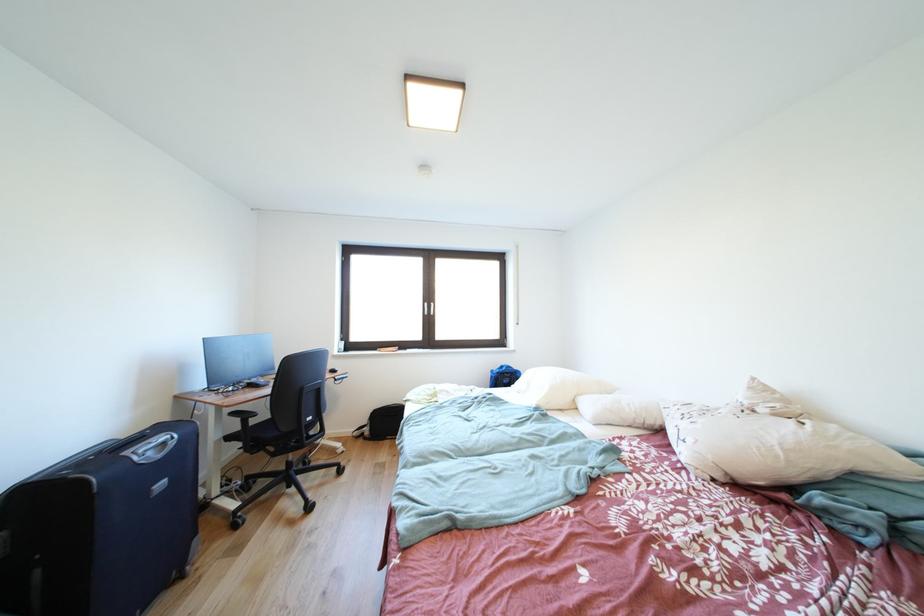
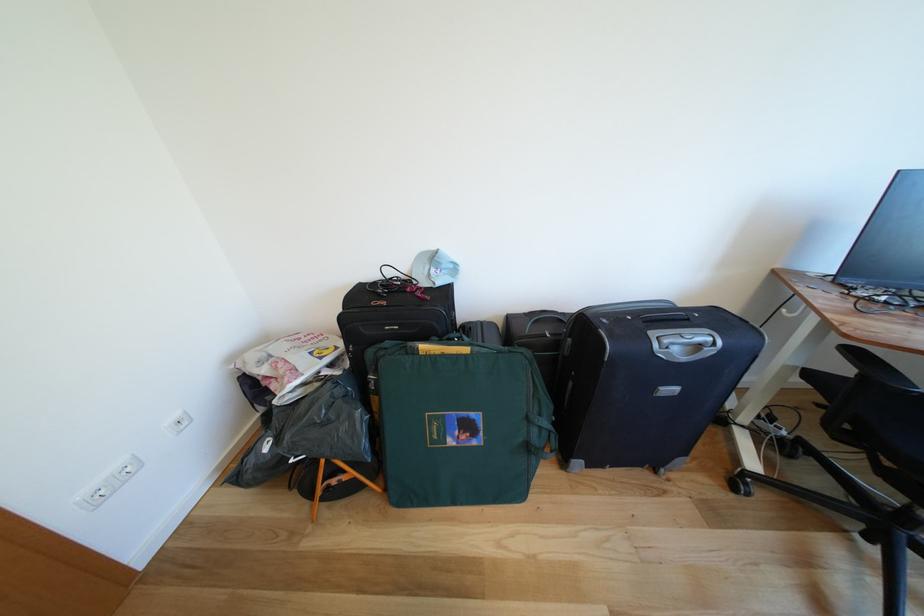
Find the pixel in the second image that matches the point at 244,418 in the first image.

(862, 357)